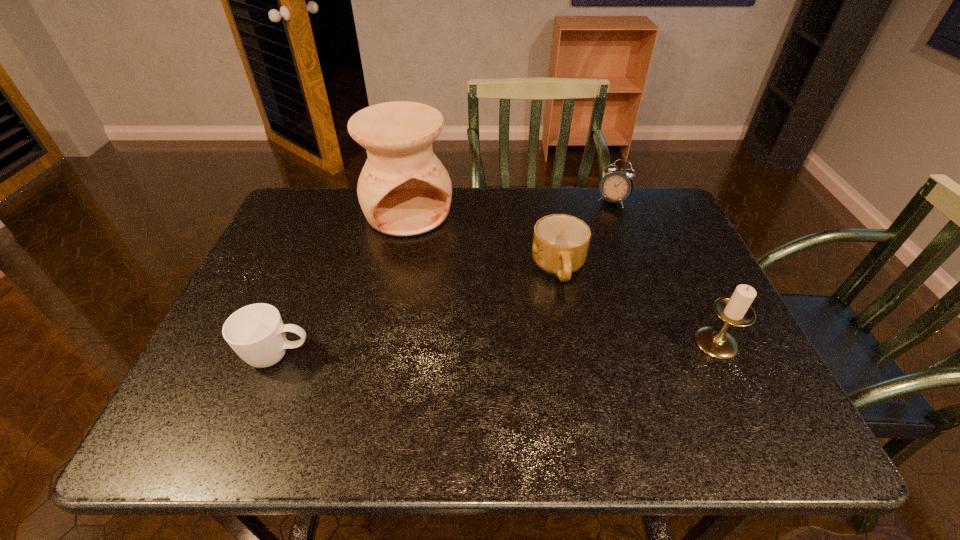
Locate an element on the screen. Image resolution: width=960 pixels, height=540 pixels. the leftmost object is located at coordinates (256, 333).

Locate an element on the screen. The height and width of the screenshot is (540, 960). the second tallest object is located at coordinates (735, 310).

This screenshot has width=960, height=540. What are the coordinates of `the rightmost object` in the screenshot? It's located at (735, 310).

Locate an element on the screen. the third farthest object is located at coordinates (560, 244).

Locate an element on the screen. The height and width of the screenshot is (540, 960). the third object from left to right is located at coordinates (560, 244).

At what (x,y) coordinates should I click in order to perform the action: click on the second object from right to left. Please return your answer as a coordinate pair (x, y). The width and height of the screenshot is (960, 540). Looking at the image, I should click on (616, 186).

Image resolution: width=960 pixels, height=540 pixels. I want to click on the tallest object, so click(404, 190).

Locate an element on the screen. The height and width of the screenshot is (540, 960). the fourth object from right to left is located at coordinates (404, 190).

Locate an element on the screen. The width and height of the screenshot is (960, 540). vacant position located with the handle on the side of the cup is located at coordinates (429, 356).

Identify the location of free space located 0.190m on the back of the candle holder. This screenshot has width=960, height=540. click(x=682, y=271).